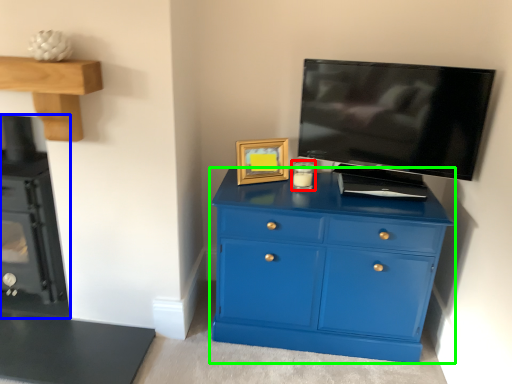
Question: Which object is positioned farthest from candle holder (highlighted by a red box)? Select from appliance (highlighted by a blue box) and chest of drawers (highlighted by a green box).

Choices:
 (A) appliance
 (B) chest of drawers

Answer: (A)